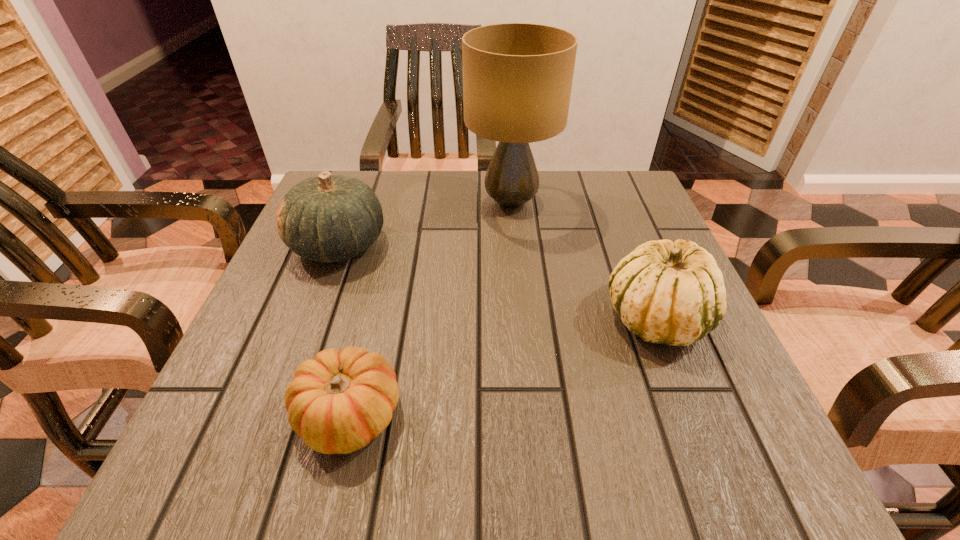
Find the location of a particular element. Image resolution: width=960 pixels, height=540 pixels. free space that is in between the lampshade and the farthest gourd is located at coordinates (424, 224).

You are a GUI agent. You are given a task and a screenshot of the screen. Output one action in this format:
    pyautogui.click(x=<x>, y=<y>)
    Task: Click on the free spot between the shortest object and the tallest object
    Image resolution: width=960 pixels, height=540 pixels.
    Given the screenshot: What is the action you would take?
    tap(430, 308)

Where is `object that is the closest to the lampshade`? Image resolution: width=960 pixels, height=540 pixels. object that is the closest to the lampshade is located at coordinates coord(328,218).

You are a GUI agent. You are given a task and a screenshot of the screen. Output one action in this format:
    pyautogui.click(x=<x>, y=<y>)
    Task: Click on the object that is the second nearest to the shortest object
    
    Given the screenshot: What is the action you would take?
    pyautogui.click(x=667, y=292)

This screenshot has width=960, height=540. Find the location of `gourd that is the closest to the farthest gourd`. gourd that is the closest to the farthest gourd is located at coordinates (338, 402).

In order to click on the second closest gourd relative to the rightmost gourd in this screenshot , I will do `click(328, 218)`.

Locate an element on the screen. vacant space that satisfies the following two spatial constraints: 1. on the front side of the third farthest object; 2. on the left side of the lampshade is located at coordinates (521, 317).

What are the coordinates of `vacant region that satisfies the following two spatial constraints: 1. on the back side of the rightmost gourd; 2. on the left side of the shortest object` in the screenshot? It's located at (372, 317).

The width and height of the screenshot is (960, 540). Identify the location of free region that satisfies the following two spatial constraints: 1. on the back side of the farthest gourd; 2. on the left side of the second object from right to left. (354, 202).

This screenshot has width=960, height=540. Find the location of `free point that satisfies the following two spatial constraints: 1. on the back side of the lampshade; 2. on the right side of the farthest gourd`. free point that satisfies the following two spatial constraints: 1. on the back side of the lampshade; 2. on the right side of the farthest gourd is located at coordinates (354, 202).